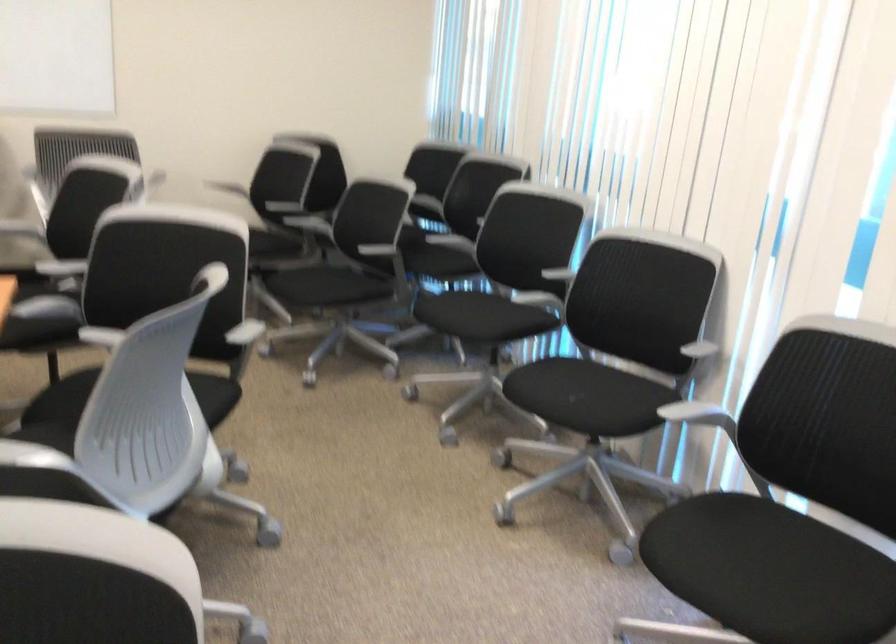
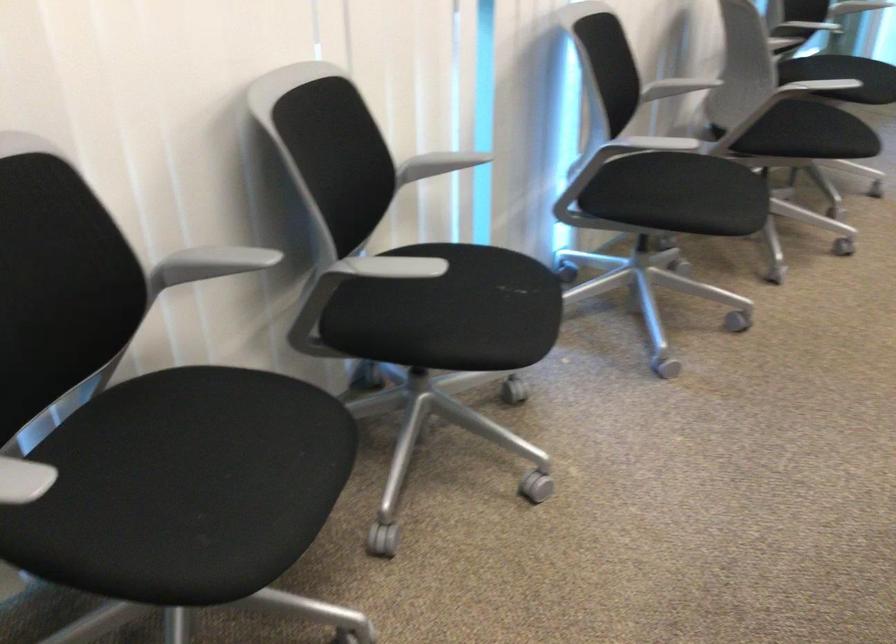
The point at (x=690, y=357) is marked in the first image. Where is the corresponding point in the second image?

(438, 164)